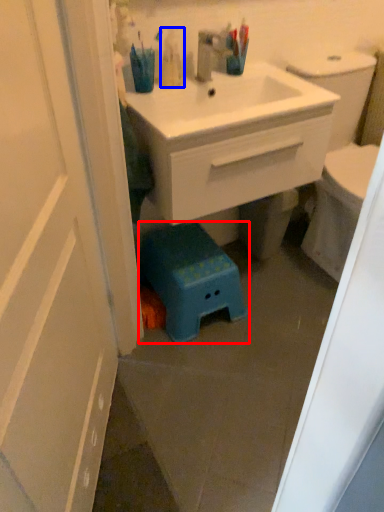
Question: Which of the following is the closest to the observer, step stool (highlighted by a red box) or toiletry (highlighted by a blue box)?

Choices:
 (A) step stool
 (B) toiletry

Answer: (B)